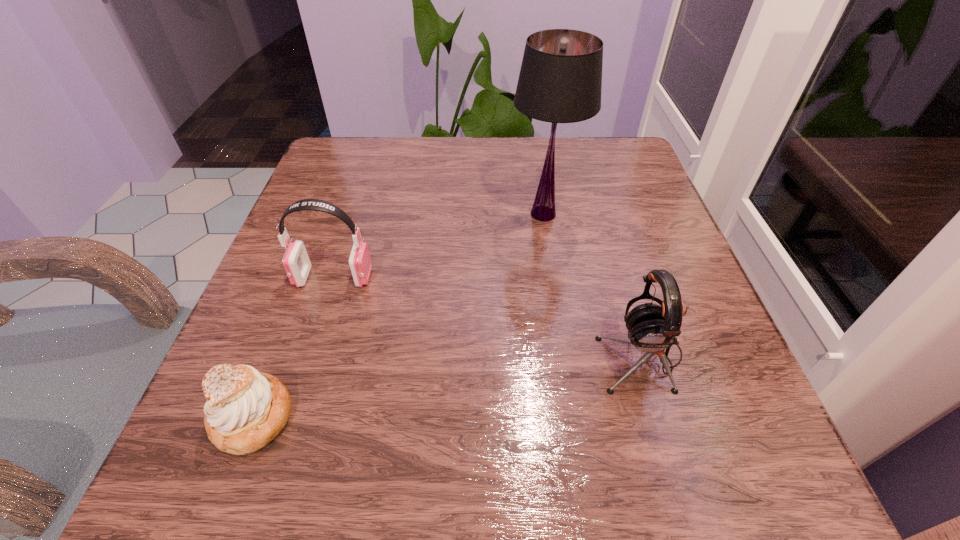
Identify the location of the tallest object. Image resolution: width=960 pixels, height=540 pixels. (560, 81).

Identify the location of the farthest object. (560, 81).

Locate an element on the screen. the nearer earphone is located at coordinates (652, 328).

Image resolution: width=960 pixels, height=540 pixels. Identify the location of the farther earphone. (296, 262).

The image size is (960, 540). What are the coordinates of `the third nearest object` in the screenshot? It's located at (296, 262).

Find the location of a particular element. The width and height of the screenshot is (960, 540). pastry is located at coordinates (245, 410).

Find the location of a particular element. vacant region located on the front-facing side of the tallest object is located at coordinates (434, 214).

Locate an element on the screen. free location located 0.390m on the front-facing side of the tallest object is located at coordinates (317, 214).

Identify the location of free space located on the front-facing side of the tallest object. The image size is (960, 540). (405, 214).

The height and width of the screenshot is (540, 960). Find the location of `free region located on the back of the nearer earphone`. free region located on the back of the nearer earphone is located at coordinates (624, 299).